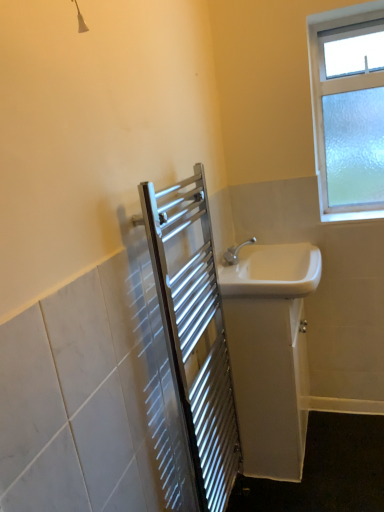
Question: Considering the positions of white glossy sink at right, the first sink in the bottom-to-top sequence, and frosted glass window at upper right in the image, is white glossy sink at right, the first sink in the bottom-to-top sequence, taller or shorter than frosted glass window at upper right?

Choices:
 (A) tall
 (B) short

Answer: (B)

Question: Do you think white glossy sink at right, the 2th sink from the top, is within frosted glass window at upper right, or outside of it?

Choices:
 (A) inside
 (B) outside

Answer: (B)

Question: Which is nearer to the frosted glass window at upper right?

Choices:
 (A) white glossy sink at right, arranged as the second sink when ordered from the bottom
 (B) white glossy sink at right, the first sink in the bottom-to-top sequence
 (C) polished stainless steel towel rack at center-left

Answer: (A)

Question: Estimate the real-world distances between objects in this image. Which object is closer to the white glossy sink at right, arranged as the second sink when ordered from the bottom?

Choices:
 (A) polished stainless steel towel rack at center-left
 (B) white glossy sink at right, the first sink in the bottom-to-top sequence
 (C) frosted glass window at upper right

Answer: (B)